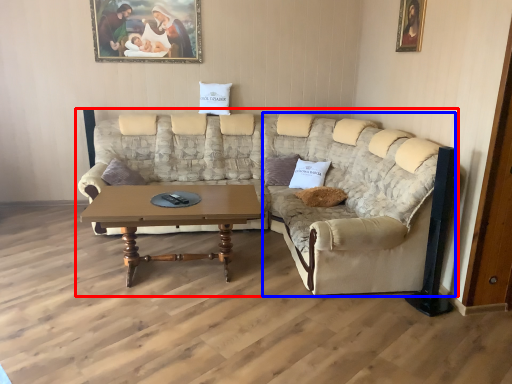
Question: Which object is further to the camera taking this photo, studio couch (highlighted by a red box) or couch (highlighted by a blue box)?

Choices:
 (A) studio couch
 (B) couch

Answer: (B)